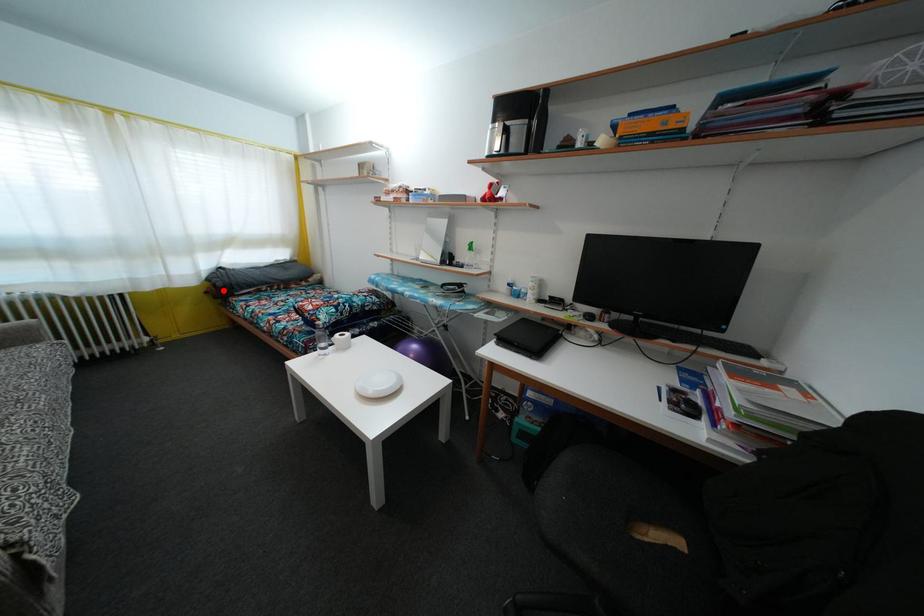
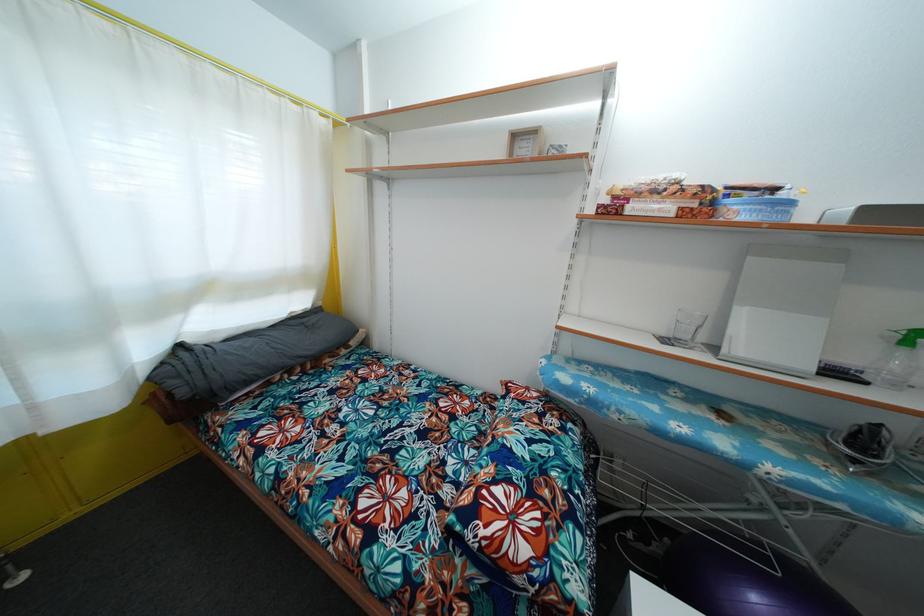
In the second image, find the point that corresponds to the highlighted location in the first image.

(187, 399)